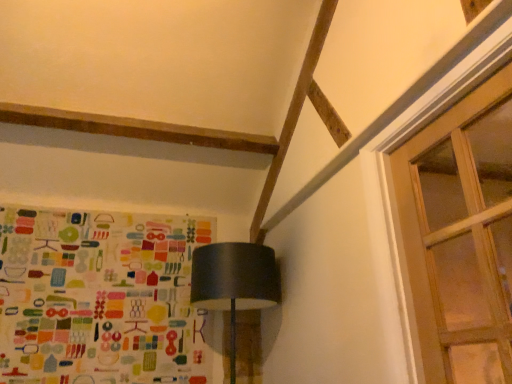
Question: Looking at their shapes, would you say matte black lampshade at center is wider or thinner than multicolored fabric at left?

Choices:
 (A) wide
 (B) thin

Answer: (A)

Question: From a real-world perspective, is matte black lampshade at center above or below multicolored fabric at left?

Choices:
 (A) above
 (B) below

Answer: (B)

Question: Based on their relative distances, which object is farther from the matte black lampshade at center?

Choices:
 (A) clear glass door at upper right
 (B) multicolored fabric at left

Answer: (A)

Question: Which object is positioned farthest from the clear glass door at upper right?

Choices:
 (A) multicolored fabric at left
 (B) matte black lampshade at center

Answer: (A)